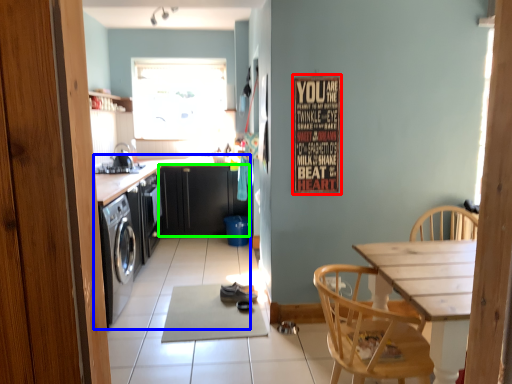
Question: Considering the real-world distances, which object is closest to bulletin board (highlighted by a red box)? cabinetry (highlighted by a blue box) or cabinetry (highlighted by a green box).

Choices:
 (A) cabinetry
 (B) cabinetry

Answer: (A)